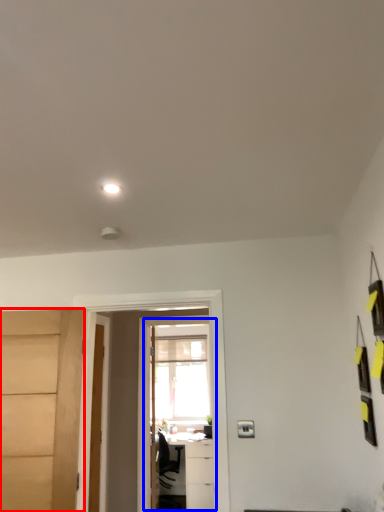
Question: Which of the following is the farthest to the observer, door (highlighted by a red box) or screen door (highlighted by a blue box)?

Choices:
 (A) door
 (B) screen door

Answer: (B)